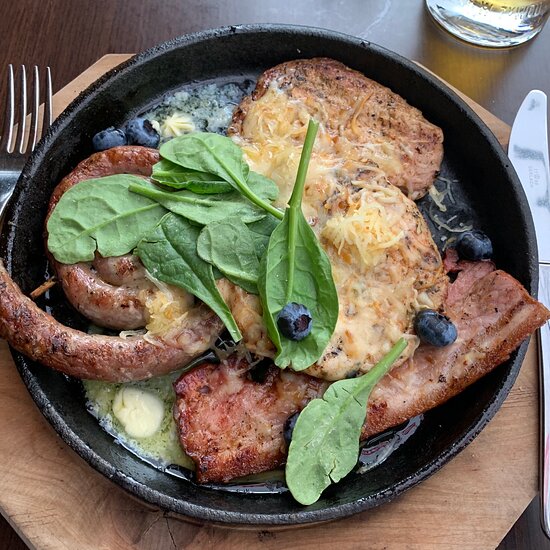
At what (x,y) coordinates should I click in order to perform the action: click on fork. Please return your answer as a coordinate pair (x, y). The width and height of the screenshot is (550, 550). Looking at the image, I should click on (13, 165).